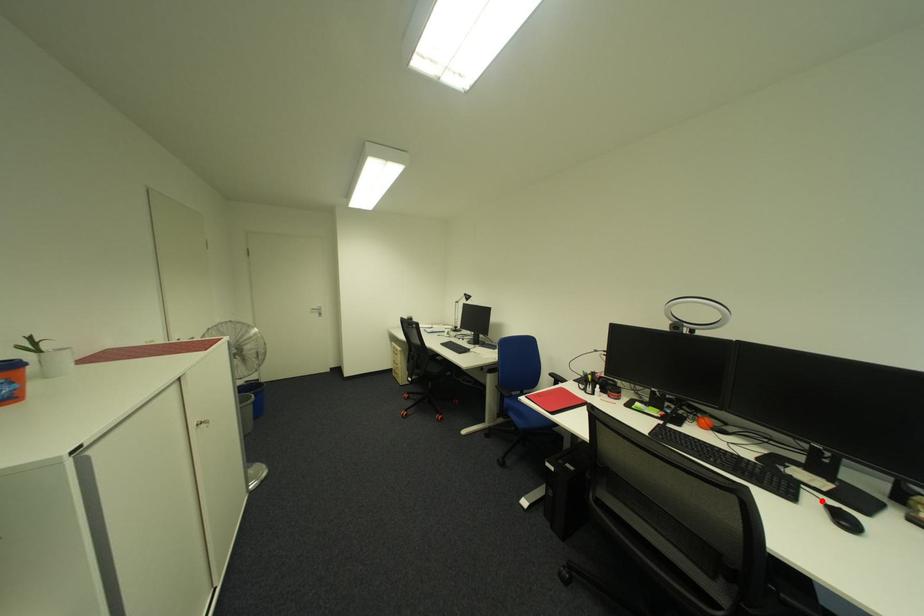
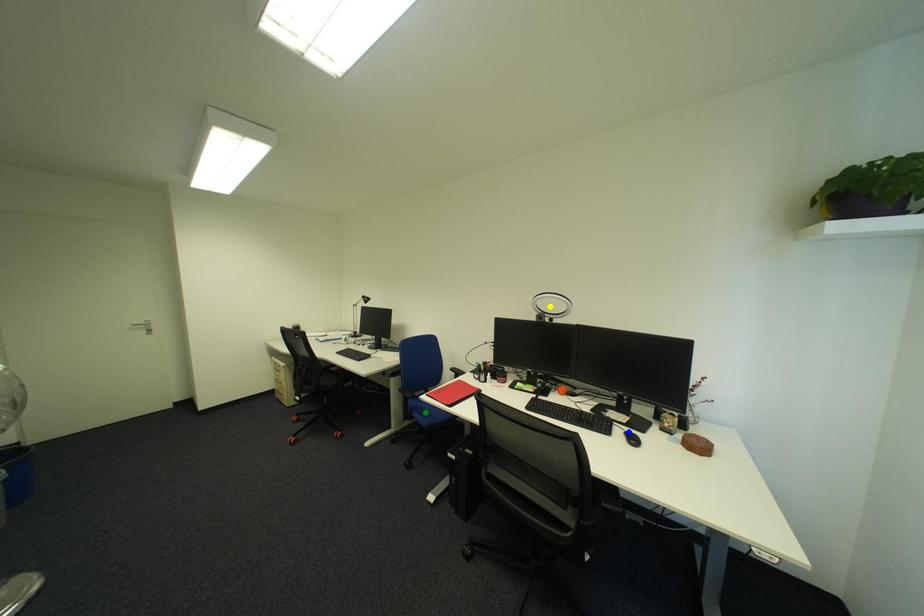
Question: I am providing you with two images of the same scene from different viewpoints. A red point is marked on the first image. You are given multiple points on the second image. Can you choose the point in image 2 that corresponds to the point in image 1?

Choices:
 (A) green point
 (B) blue point
 (C) yellow point

Answer: (B)